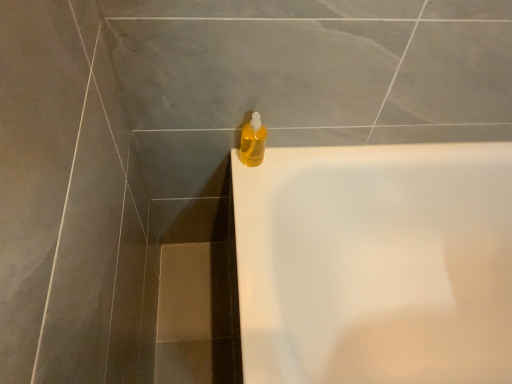
This screenshot has height=384, width=512. What are the coordinates of `vacant area that is in front of translucent yellow liquid at upper right` in the screenshot? It's located at (249, 198).